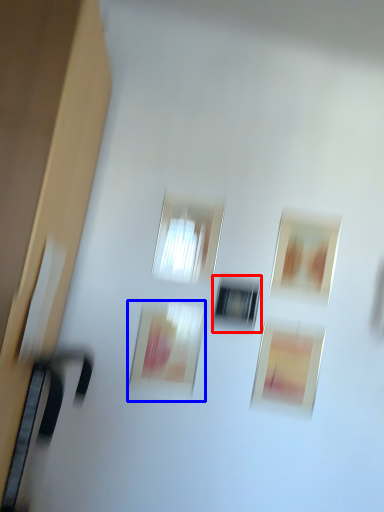
Question: Which object is closer to the camera taking this photo, window (highlighted by a red box) or picture frame (highlighted by a blue box)?

Choices:
 (A) window
 (B) picture frame

Answer: (B)